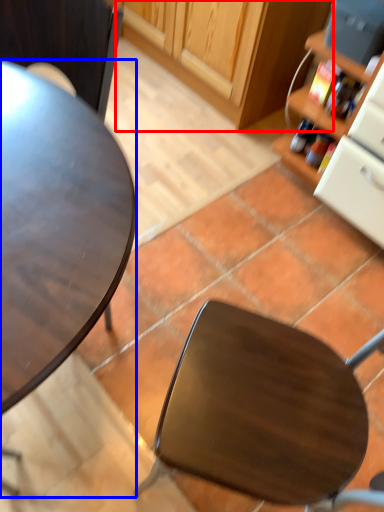
Question: Which of the following is the closest to the observer, cabinetry (highlighted by a red box) or desk (highlighted by a blue box)?

Choices:
 (A) cabinetry
 (B) desk

Answer: (B)